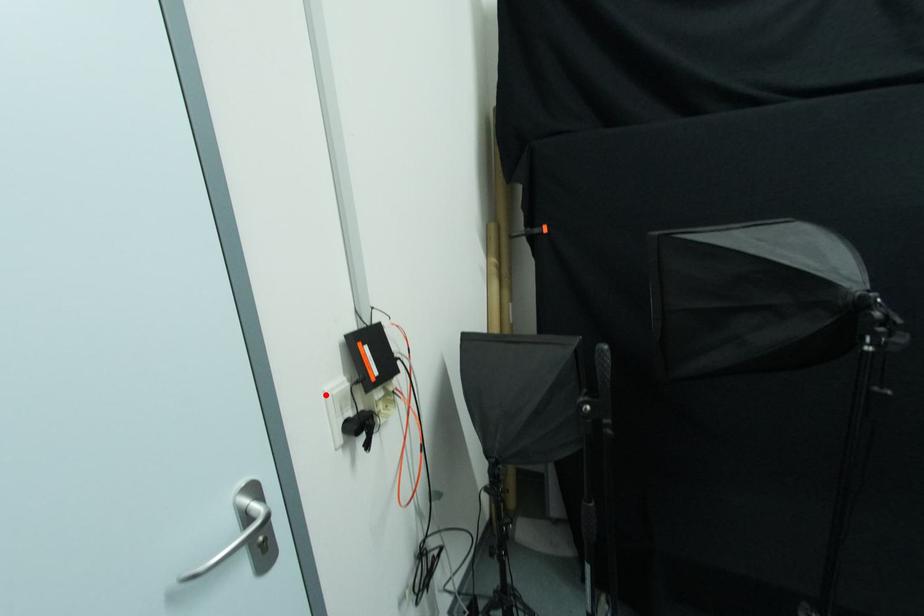
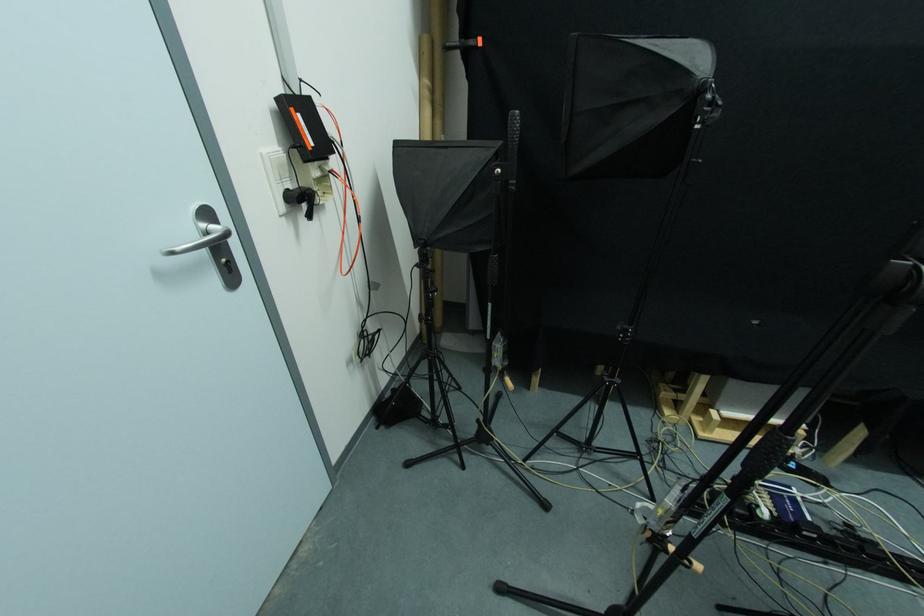
Where in the second image is the point corresponding to the highlighted location from the first image?

(262, 156)